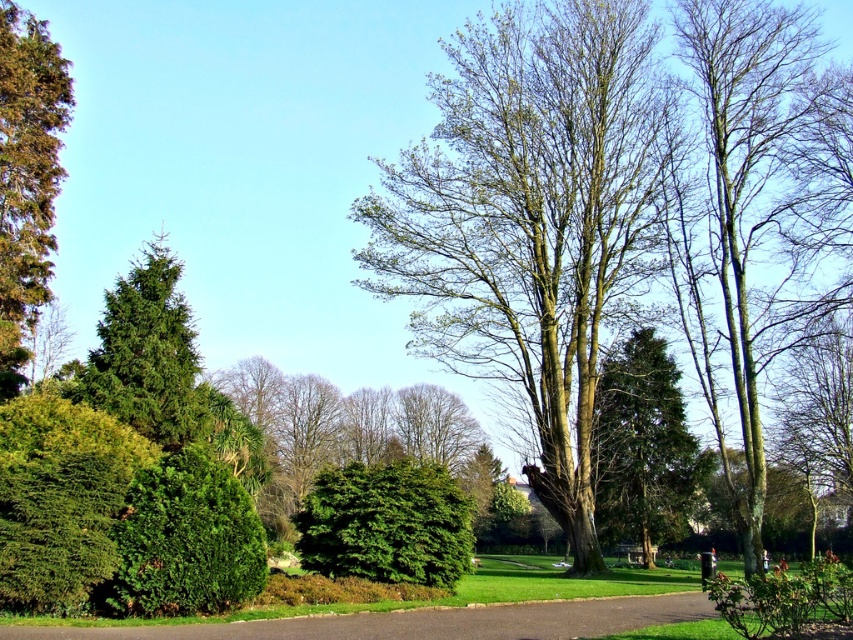
Question: Does green textured tree at center have a greater width compared to brown asphalt path at center?

Choices:
 (A) no
 (B) yes

Answer: (A)

Question: Is green leafy bush at lower left below brown textured tree at left?

Choices:
 (A) no
 (B) yes

Answer: (B)

Question: Is green leafy bush at lower left bigger than green matte bush at center?

Choices:
 (A) yes
 (B) no

Answer: (A)

Question: Which object is the farthest from the green leafy bush at lower left?

Choices:
 (A) green leafy bush at left
 (B) brown textured tree at left
 (C) brown asphalt path at center

Answer: (B)

Question: Estimate the real-world distances between objects in this image. Which object is farther from the green leafy tree at center?

Choices:
 (A) green leafy bush at left
 (B) green matte bush at center
 (C) green mossy tree at right
 (D) green needle-like at left

Answer: (A)

Question: Which is nearer to the green leafy tree at center?

Choices:
 (A) brown asphalt path at center
 (B) green mossy tree at right
 (C) green matte bush at center
 (D) green leafy bush at left

Answer: (B)